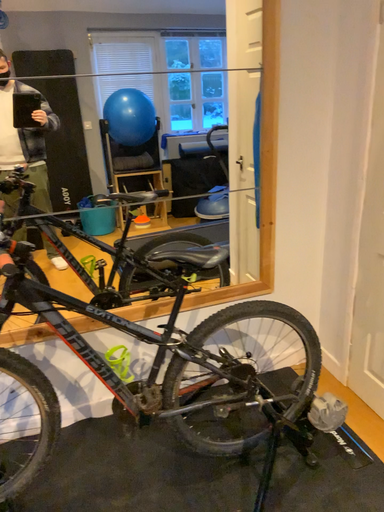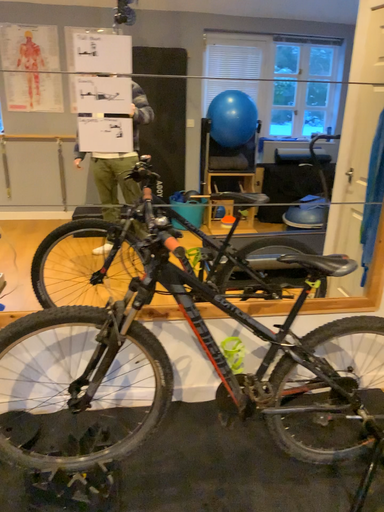
Question: How did the camera likely rotate when shooting the video?

Choices:
 (A) rotated left
 (B) rotated right

Answer: (A)